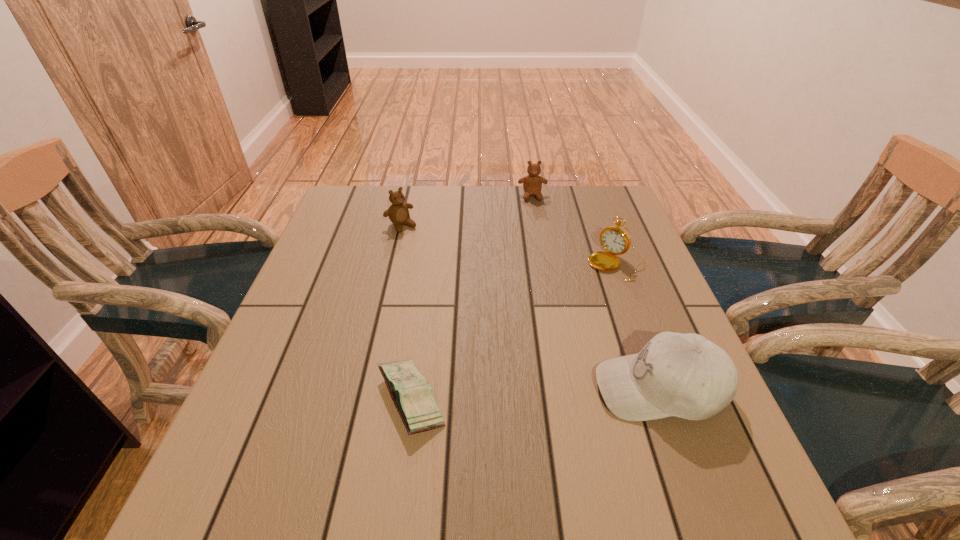
The height and width of the screenshot is (540, 960). Identify the location of diary. (413, 397).

The height and width of the screenshot is (540, 960). I want to click on baseball cap, so click(685, 375).

The height and width of the screenshot is (540, 960). Identify the location of the left teddy bear. (398, 212).

At what (x,y) coordinates should I click in order to perform the action: click on the nearer teddy bear. Please return your answer as a coordinate pair (x, y). The image size is (960, 540). Looking at the image, I should click on (398, 212).

Where is `the farther teddy bear`? The height and width of the screenshot is (540, 960). the farther teddy bear is located at coordinates (532, 183).

The image size is (960, 540). I want to click on the third object from right to left, so click(532, 183).

Find the location of a particular element. The width and height of the screenshot is (960, 540). pocket watch is located at coordinates (615, 240).

I want to click on free spot located 0.080m on the left of the shortest object, so click(333, 400).

This screenshot has width=960, height=540. I want to click on free region located 0.090m on the front-facing side of the baseball cap, so click(549, 388).

The height and width of the screenshot is (540, 960). In order to click on vacant space located on the front-facing side of the baseball cap in this screenshot , I will do coord(523,388).